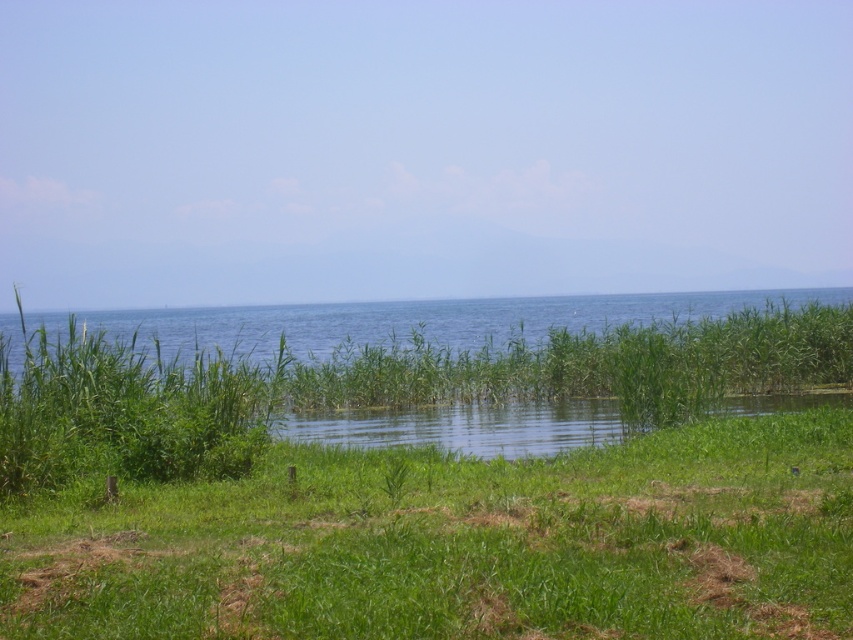
Between green grassy at lower center and green grassy water at center, which one is positioned higher?

Positioned higher is green grassy water at center.

Between green grassy at lower center and green grassy water at center, which one appears on the left side from the viewer's perspective?

green grassy at lower center

Is point (90, 616) behind point (552, 317)?

No, (90, 616) is closer to viewer.

Where is `green grassy at lower center`? The height and width of the screenshot is (640, 853). green grassy at lower center is located at coordinates (459, 544).